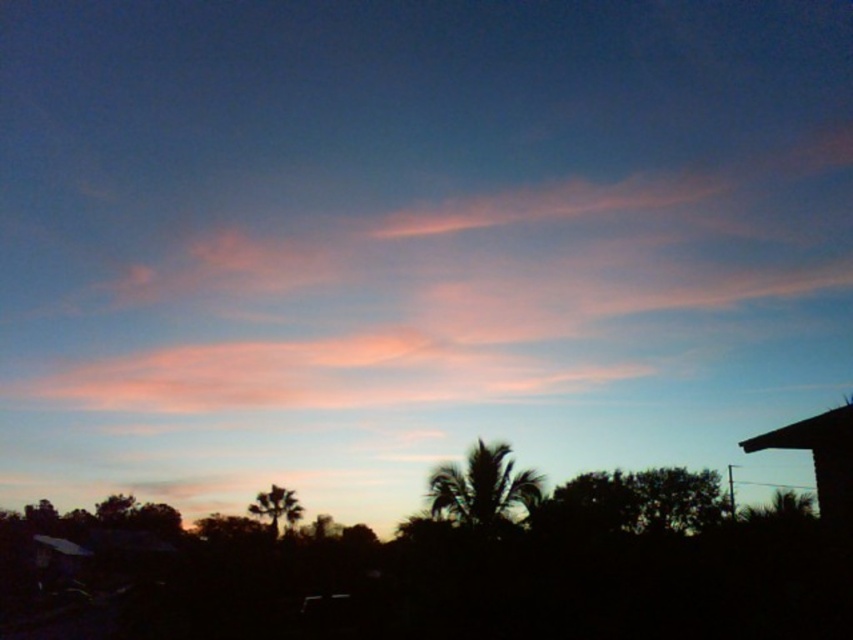
Who is taller, silhouette palm tree at center or sandy brown palm tree at center?

sandy brown palm tree at center is taller.

Does silhouette palm tree at center lie behind sandy brown palm tree at center?

No, it is not.

Is point (473, 525) closer to camera compared to point (285, 490)?

Yes, it is.

You are a GUI agent. You are given a task and a screenshot of the screen. Output one action in this format:
    pyautogui.click(x=<x>, y=<y>)
    Task: Click on the silhouette palm tree at center
    
    Given the screenshot: What is the action you would take?
    pyautogui.click(x=482, y=488)